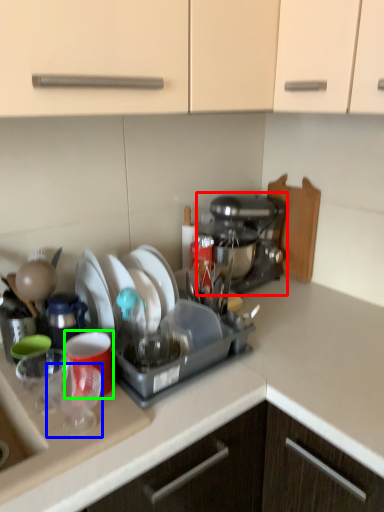
Question: Which object is positioned farthest from coffee maker (highlighted by a red box)? Select from tableware (highlighted by a blue box) and coffee cup (highlighted by a green box).

Choices:
 (A) tableware
 (B) coffee cup

Answer: (A)